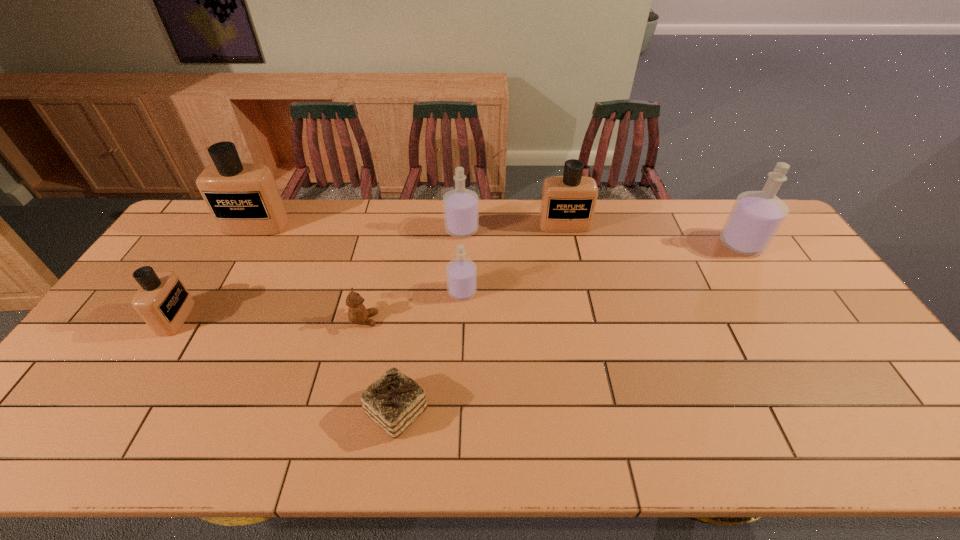
This screenshot has height=540, width=960. Find the location of `object situated at the near edge`. object situated at the near edge is located at coordinates (394, 401).

Find the location of a particular element. Image resolution: width=960 pixels, height=540 pixels. object positioned at the right edge is located at coordinates (756, 216).

Image resolution: width=960 pixels, height=540 pixels. I want to click on object positioned at the far left corner, so click(243, 198).

You are a GUI agent. You are given a task and a screenshot of the screen. Output one action in this format:
    pyautogui.click(x=<x>, y=<y>)
    Task: Click on the object that is at the far right corner
    This screenshot has height=540, width=960.
    Given the screenshot: What is the action you would take?
    pyautogui.click(x=756, y=216)

Where is `vacant area at the far edge`? vacant area at the far edge is located at coordinates (720, 233).

The image size is (960, 540). I want to click on free space at the right edge of the desktop, so click(x=845, y=352).

Locate an element on the screen. The height and width of the screenshot is (540, 960). free location at the far right corner of the desktop is located at coordinates (733, 204).

This screenshot has width=960, height=540. I want to click on vacant space at the near right corner, so click(x=878, y=421).

Find the location of a particular element. The height and width of the screenshot is (540, 960). free space between the nearest purple perfume and the rightmost perfume is located at coordinates (602, 268).

This screenshot has width=960, height=540. I want to click on free spot between the biggest beige perfume and the rightmost beige perfume, so click(x=410, y=226).